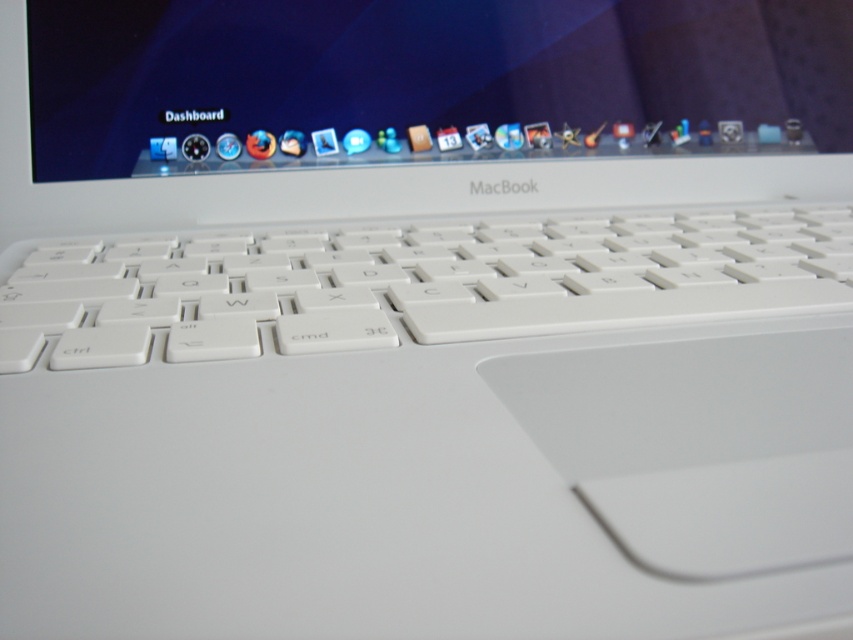
Is glossy plastic computer screen at upper center above white plastic keyboard at center?

Indeed, glossy plastic computer screen at upper center is positioned over white plastic keyboard at center.

Does glossy plastic computer screen at upper center appear on the right side of white plastic keyboard at center?

Incorrect, glossy plastic computer screen at upper center is not on the right side of white plastic keyboard at center.

Does point (207, 52) come farther from viewer compared to point (850, 269)?

Yes, point (207, 52) is behind point (850, 269).

I want to click on glossy plastic computer screen at upper center, so click(x=427, y=81).